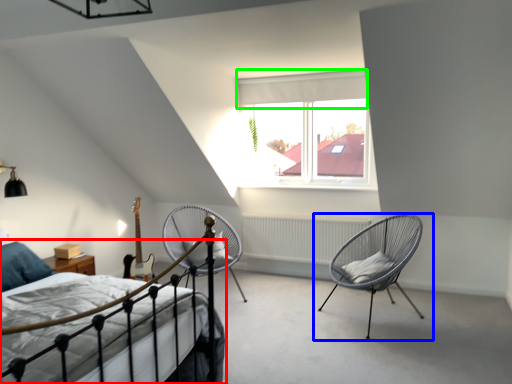
Question: Which object is positioned closest to bed (highlighted by a red box)? Select from chair (highlighted by a blue box) and curtain (highlighted by a green box).

Choices:
 (A) chair
 (B) curtain

Answer: (A)